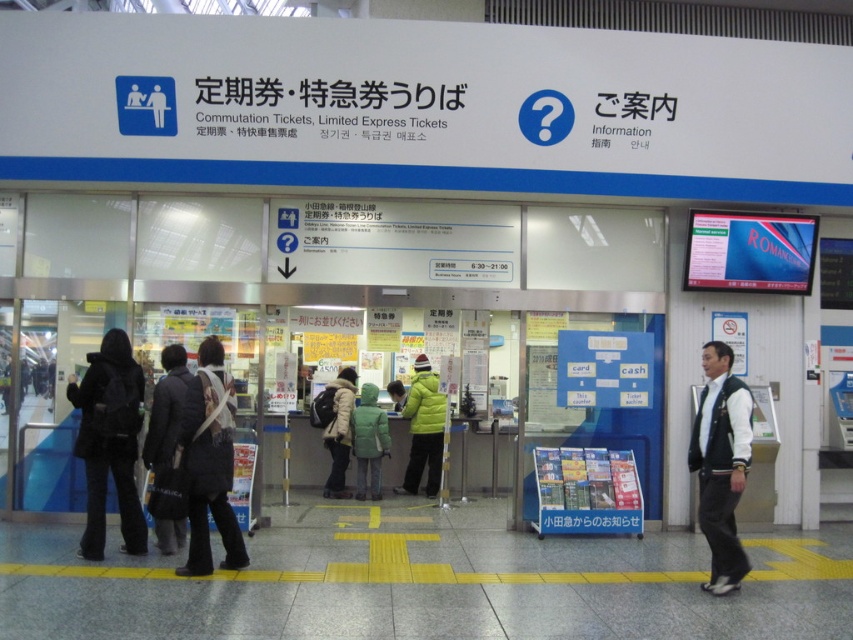
Is dark gray fabric coat at lower left smaller than white fuzzy coat at center?

Correct, dark gray fabric coat at lower left occupies less space than white fuzzy coat at center.

Which is more to the right, dark gray fabric coat at lower left or white fuzzy coat at center?

white fuzzy coat at center

Locate an element on the screen. dark gray fabric coat at lower left is located at coordinates (166, 410).

You are a GUI agent. You are given a task and a screenshot of the screen. Output one action in this format:
    pyautogui.click(x=<x>, y=<y>)
    Task: Click on the dark gray fabric coat at lower left
    The width and height of the screenshot is (853, 640).
    Given the screenshot: What is the action you would take?
    pyautogui.click(x=166, y=410)

Who is positioned more to the right, dark gray coat at center or matte yellow jacket at center?

matte yellow jacket at center

Who is higher up, dark gray coat at center or matte yellow jacket at center?

dark gray coat at center is higher up.

Does point (215, 371) come closer to viewer compared to point (436, 385)?

Yes, it is in front of point (436, 385).

This screenshot has height=640, width=853. I want to click on dark gray coat at center, so click(x=209, y=461).

Which of these two, dark gray fabric coat at lower left or green matte jacket at center, stands taller?

green matte jacket at center

Is dark gray fabric coat at lower left shorter than green matte jacket at center?

Yes, dark gray fabric coat at lower left is shorter than green matte jacket at center.

Who is more distant from viewer, (166, 346) or (381, 422)?

The point (381, 422) is behind.

Find the location of `dark gray fabric coat at lower left`. dark gray fabric coat at lower left is located at coordinates (166, 410).